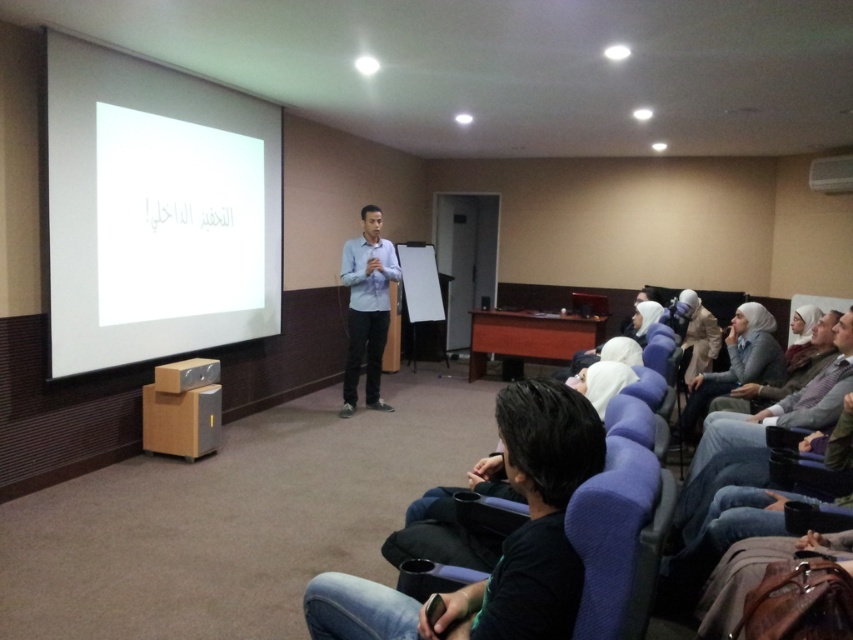
You are organizing a presentation and need to choose between two shirts for your outfit. The black matte shirt at lower center and the light blue shirt at center are options. Based on their sizes, which one would you recommend for a more professional appearance?

The light blue shirt at center is larger than the black matte shirt at lower center, so it would be more appropriate for a professional presentation as it provides a more polished and authoritative look.

You are an attendee in the classroom and need to determine which object is wider between the white matte projection screen at upper left and the white fabric hijab at lower right. Based on the scene, which one is wider?

The white matte projection screen at upper left is wider than the white fabric hijab at lower right according to the description.